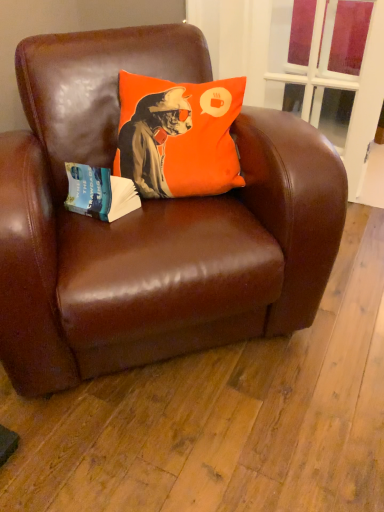
Question: Looking at their shapes, would you say brown leather chair at center is wider or thinner than transparent glass window at upper center?

Choices:
 (A) wide
 (B) thin

Answer: (A)

Question: Is brown leather chair at center in front of or behind transparent glass window at upper center in the image?

Choices:
 (A) behind
 (B) front

Answer: (B)

Question: Which of these objects is positioned farthest from the orange fabric pillow at upper center?

Choices:
 (A) blue paper at left
 (B) brown leather chair at center
 (C) transparent glass window at upper center

Answer: (C)

Question: Which is nearer to the brown leather chair at center?

Choices:
 (A) orange fabric pillow at upper center
 (B) transparent glass window at upper center
 (C) blue paper at left

Answer: (A)